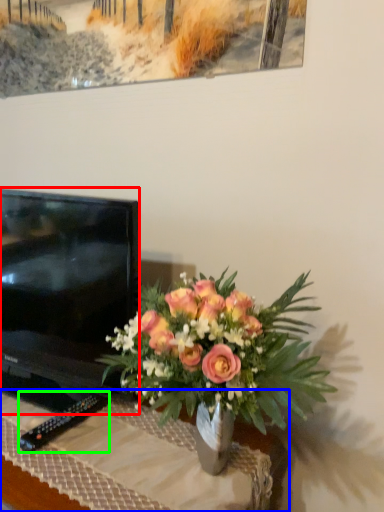
Question: Based on their relative distances, which object is nearer to television (highlighted by a red box)? Choose from desk (highlighted by a blue box) and remote (highlighted by a green box).

Choices:
 (A) desk
 (B) remote

Answer: (A)